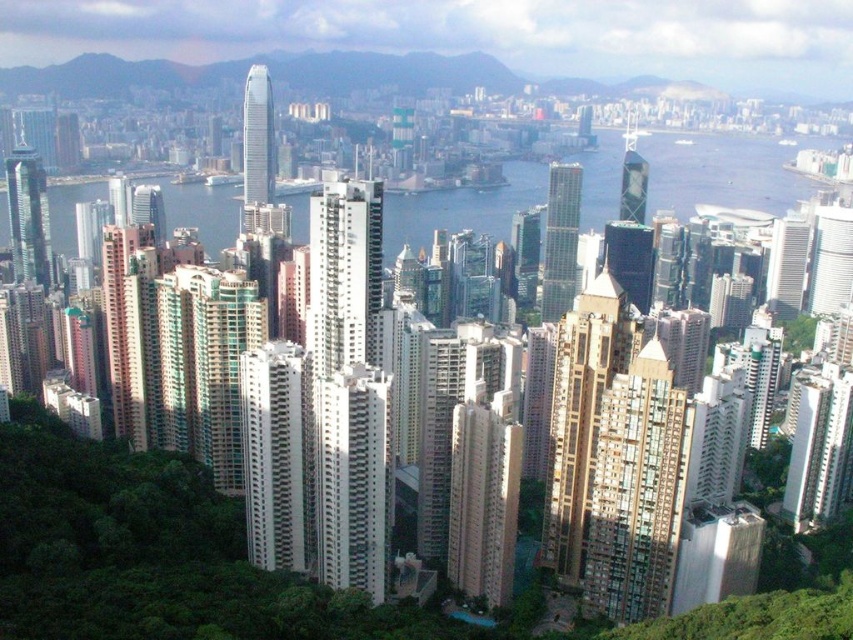
You are standing at the center of the city and looking towards the waterfront. There is a point marked at coordinates (x=724, y=172). What is located at that point?

The point at coordinates (x=724, y=172) is occupied by transparent glass water at center.

You are a city planner analyzing the urban layout. Given the presence of transparent glass water at center and beige concrete building at center, which object would you prioritize for a flood prevention project? Explain your reasoning based on their spatial relationship.

The beige concrete building at center should be prioritized for flood prevention because the transparent glass water at center is located above it, indicating proximity to potential flooding risks.